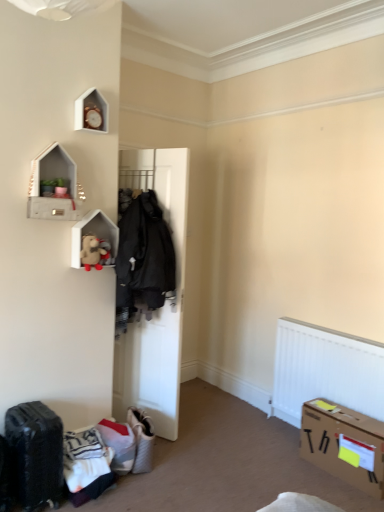
Locate an element on the screen. free location to the right of white matte door at center is located at coordinates (201, 431).